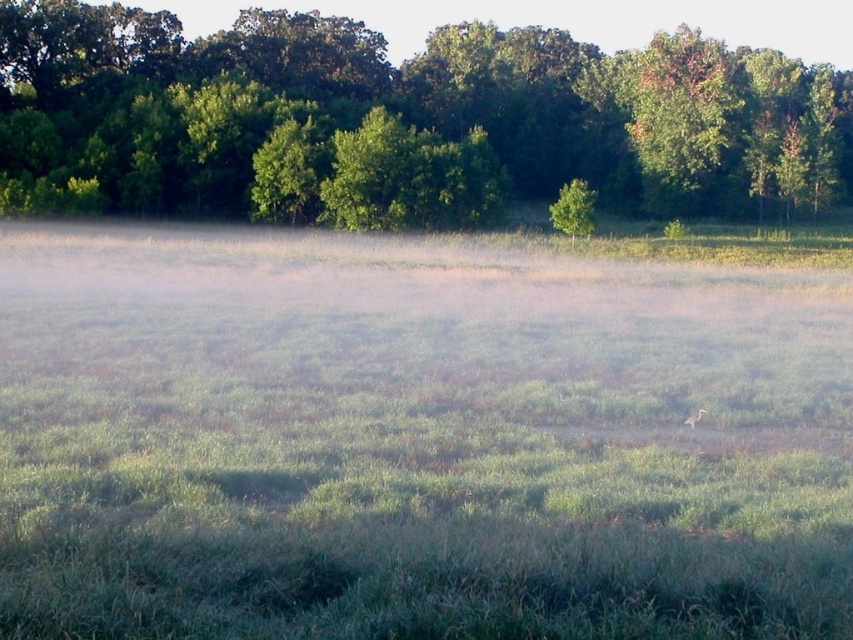
Who is taller, green leafy tree at upper center or green matte tree at center?

green leafy tree at upper center

Between green leafy tree at upper center and green matte tree at center, which one is positioned lower?

green matte tree at center is lower down.

Where is `green leafy tree at upper center`? green leafy tree at upper center is located at coordinates (409, 118).

At what (x,y) coordinates should I click in order to perform the action: click on green leafy tree at upper center. Please return your answer as a coordinate pair (x, y). The image size is (853, 640). Looking at the image, I should click on (409, 118).

You are a GUI agent. You are given a task and a screenshot of the screen. Output one action in this format:
    pyautogui.click(x=<x>, y=<y>)
    Task: Click on the green matte tree at center
    The height and width of the screenshot is (640, 853).
    Given the screenshot: What is the action you would take?
    pyautogui.click(x=573, y=209)

Does green matte tree at center have a smaller size compared to brown feathered bird at center?

Incorrect, green matte tree at center is not smaller in size than brown feathered bird at center.

The height and width of the screenshot is (640, 853). Identify the location of green matte tree at center. (573, 209).

Find the location of a particular element. This screenshot has height=640, width=853. green matte tree at center is located at coordinates (573, 209).

Can you confirm if green grassy field at center is bigger than green matte tree at center?

Yes.

I want to click on green grassy field at center, so click(413, 442).

What are the coordinates of `green grassy field at center` in the screenshot? It's located at (413, 442).